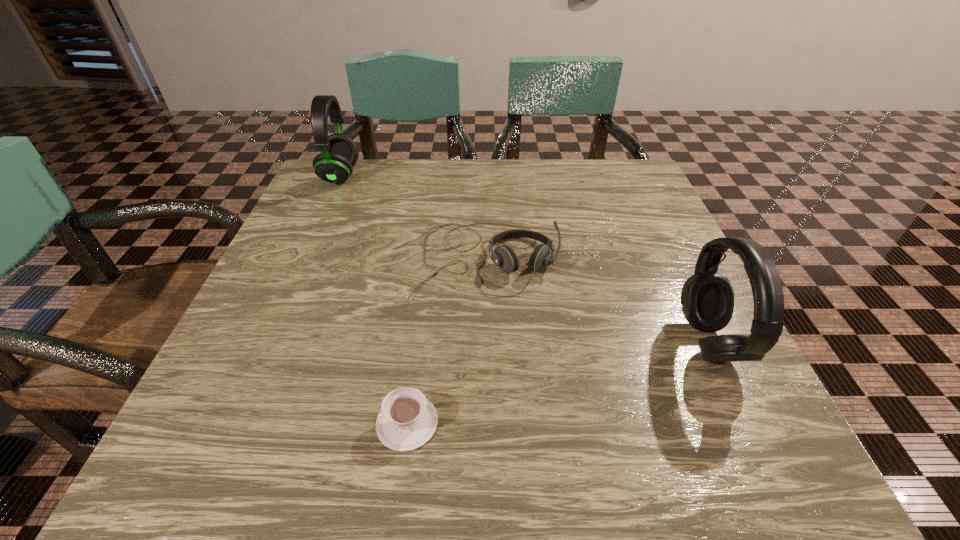
Where is `the farthest headset`? the farthest headset is located at coordinates (339, 153).

You are a GUI agent. You are given a task and a screenshot of the screen. Output one action in this format:
    pyautogui.click(x=<x>, y=<y>)
    Task: Click on the farthest object
    
    Given the screenshot: What is the action you would take?
    pyautogui.click(x=339, y=153)

Find the location of a particular element. the rightmost headset is located at coordinates (707, 297).

Image resolution: width=960 pixels, height=540 pixels. What are the coordinates of `the second headset from left to right` in the screenshot? It's located at (503, 256).

Locate an element on the screen. Image resolution: width=960 pixels, height=540 pixels. the shortest headset is located at coordinates (503, 256).

This screenshot has height=540, width=960. I want to click on teacup, so click(x=407, y=420).

Where is `the shortest object`? The width and height of the screenshot is (960, 540). the shortest object is located at coordinates (407, 420).

This screenshot has width=960, height=540. In order to click on free space located 0.250m on the ear cups of the farthest object in this screenshot , I will do `click(457, 176)`.

Find the location of a particular element. Image resolution: width=960 pixels, height=540 pixels. vacant space located 0.210m on the earcups of the rightmost object is located at coordinates (558, 342).

I want to click on blank space located 0.060m on the earcups of the rightmost object, so click(x=649, y=342).